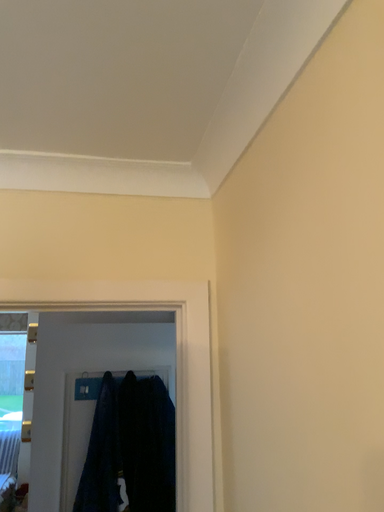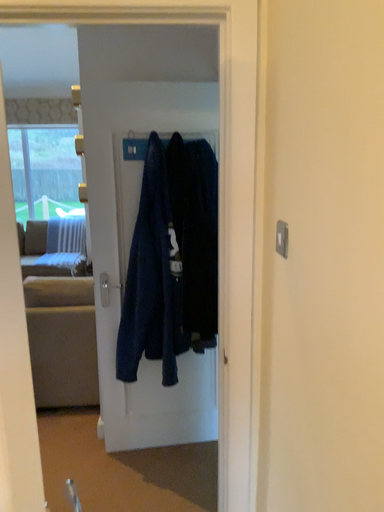
Question: How did the camera likely rotate when shooting the video?

Choices:
 (A) rotated downward
 (B) rotated upward

Answer: (A)